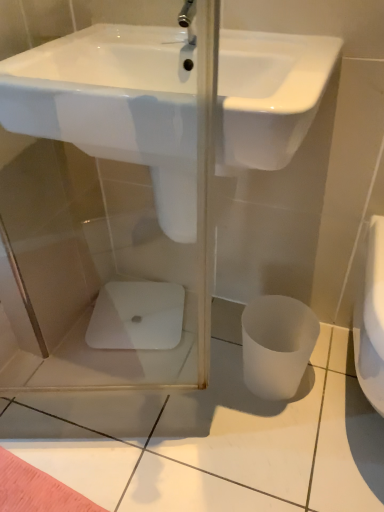
Locate an element on the screen. The width and height of the screenshot is (384, 512). vacant space in front of white glossy porcelain at center is located at coordinates (140, 378).